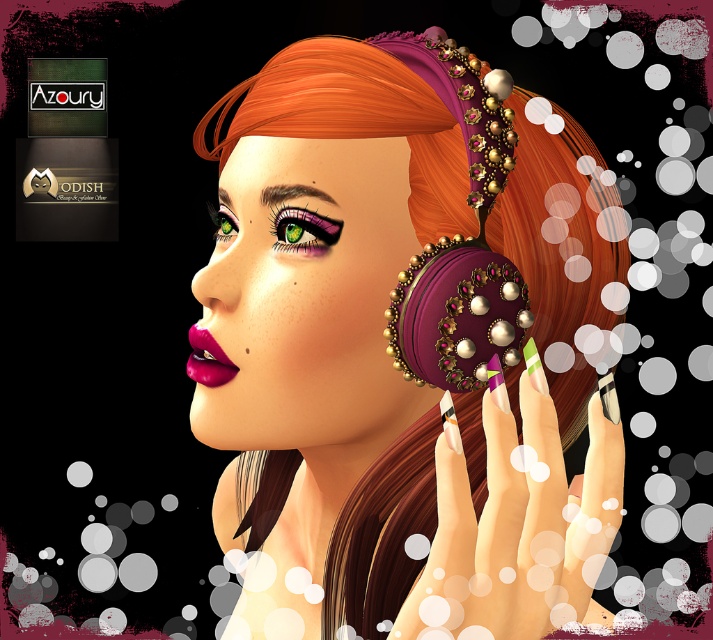
Locate an element on the screen. The width and height of the screenshot is (713, 640). matte purple earring at center is located at coordinates (396, 346).

Which is below, matte purple earring at center or nail polish at center?

nail polish at center is below.

Who is more forward, (x=491, y=218) or (x=553, y=500)?

Point (x=553, y=500) is more forward.

You are a GUI agent. You are given a task and a screenshot of the screen. Output one action in this format:
    pyautogui.click(x=<x>, y=<y>)
    Task: Click on the matte purple earring at center
    This screenshot has width=713, height=640.
    Given the screenshot: What is the action you would take?
    pyautogui.click(x=396, y=346)

Is matte purple earring at center to the left of matte pink lipstick at lower left from the viewer's perspective?

In fact, matte purple earring at center is to the right of matte pink lipstick at lower left.

Locate an element on the screen. The width and height of the screenshot is (713, 640). matte purple earring at center is located at coordinates (396, 346).

Does nail polish at center appear over matte pink lipstick at lower left?

Actually, nail polish at center is below matte pink lipstick at lower left.

Between nail polish at center and matte pink lipstick at lower left, which one has more height?

nail polish at center is taller.

Measure the distance between nail polish at center and camera.

nail polish at center and camera are 11.44 inches apart from each other.

Identify the location of nail polish at center. Image resolution: width=713 pixels, height=640 pixels. (518, 525).